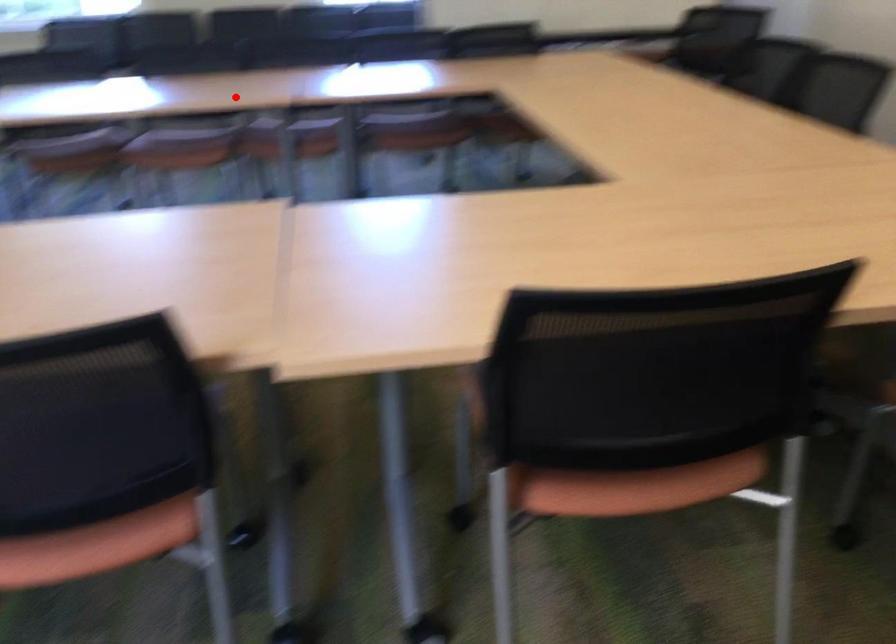
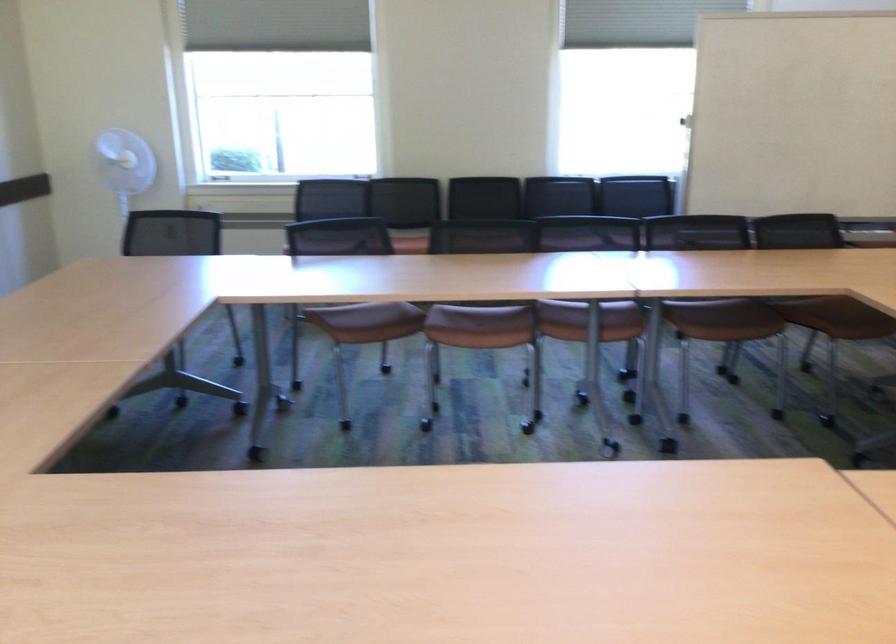
The point at the highlighted location is marked in the first image. Where is the corresponding point in the second image?

(590, 292)